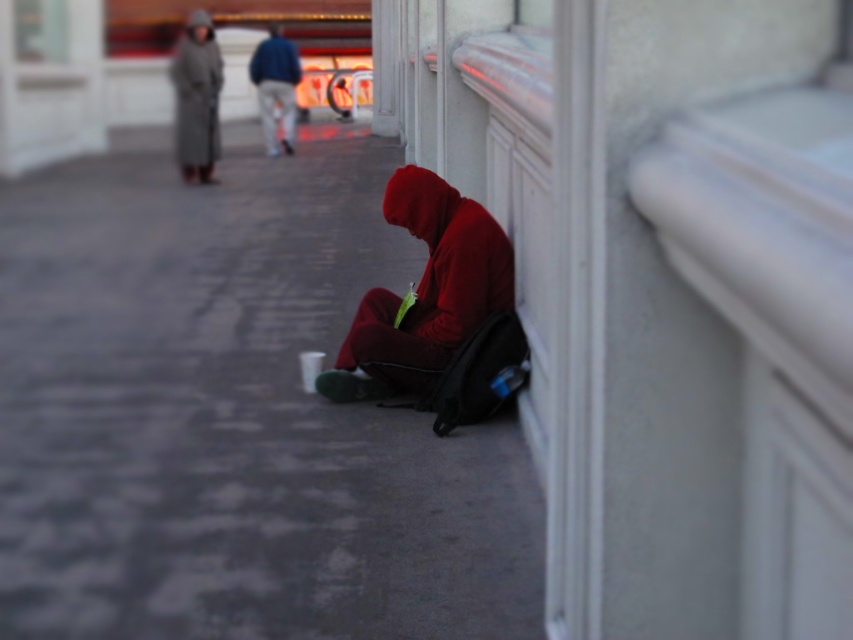
Who is lower down, gray concrete pavement at lower left or blue denim jeans at center?

gray concrete pavement at lower left is below.

Is gray concrete pavement at lower left below blue denim jeans at center?

Yes.

Which is in front, point (132, 148) or point (287, 74)?

Point (132, 148) is more forward.

This screenshot has width=853, height=640. I want to click on gray concrete pavement at lower left, so click(231, 412).

Which is in front, point (335, 627) or point (190, 77)?

Point (335, 627)

Is gray concrete pavement at lower left positioned in front of gray wool coat at upper left?

Yes, gray concrete pavement at lower left is closer to the viewer.

Is point (381, 228) closer to camera compared to point (196, 125)?

Yes.

The height and width of the screenshot is (640, 853). What are the coordinates of `gray concrete pavement at lower left` in the screenshot? It's located at (231, 412).

Is the position of matte red hoodie at center more distant than that of blue denim jeans at center?

No.

Between matte red hoodie at center and blue denim jeans at center, which one is positioned lower?

matte red hoodie at center

Who is more distant from viewer, (x=410, y=388) or (x=281, y=115)?

Point (x=281, y=115)

The image size is (853, 640). Identify the location of matte red hoodie at center. (424, 292).